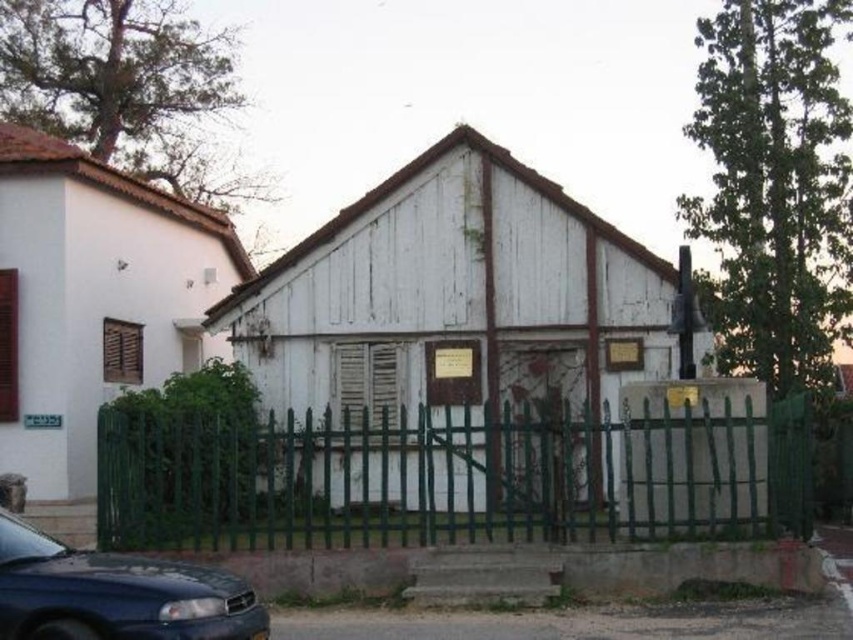
Question: Among these points, which one is nearest to the camera?

Choices:
 (A) (252, 620)
 (B) (242, 429)

Answer: (A)

Question: Can you confirm if green metal fence at center is positioned to the left of shiny blue sedan at lower left?

Choices:
 (A) no
 (B) yes

Answer: (B)

Question: Is green metal fence at center below shiny blue sedan at lower left?

Choices:
 (A) no
 (B) yes

Answer: (B)

Question: Is green metal fence at center further to camera compared to shiny blue sedan at lower left?

Choices:
 (A) no
 (B) yes

Answer: (B)

Question: Which point is farther to the camera?

Choices:
 (A) shiny blue sedan at lower left
 (B) green metal fence at center

Answer: (B)